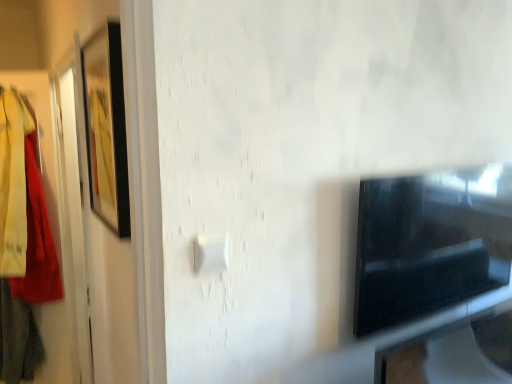
In order to face black glossy tv at right, should I rotate leftwards or rightwards?

Rotate your view right by about 24.188°.

Find the location of `white plastic light switch at center`. white plastic light switch at center is located at coordinates (211, 253).

This screenshot has height=384, width=512. Describe the element at coordinates (211, 253) in the screenshot. I see `white plastic light switch at center` at that location.

This screenshot has height=384, width=512. Find the location of `black glossy tv at right`. black glossy tv at right is located at coordinates (430, 243).

Does matte black picture frame at left turn towards black glossy tv at right?

No.

What are the coordinates of `picture frame above the black glossy tv at right (from a real-world perspective)` in the screenshot? It's located at (106, 128).

Is point (117, 90) closer to viewer compared to point (369, 246)?

Yes.

In terms of height, does matte black picture frame at left look taller or shorter compared to black glossy tv at right?

Clearly, matte black picture frame at left is taller compared to black glossy tv at right.

Considering the relative sizes of white plastic light switch at center and matte black picture frame at left in the image provided, is white plastic light switch at center shorter than matte black picture frame at left?

Indeed, white plastic light switch at center has a lesser height compared to matte black picture frame at left.

Is white plastic light switch at center oriented towards matte black picture frame at left?

No, white plastic light switch at center is not aimed at matte black picture frame at left.

What's the angular difference between white plastic light switch at center and matte black picture frame at left's facing directions?

The facing directions of white plastic light switch at center and matte black picture frame at left are 88.7 degrees apart.

From a real-world perspective, does white plastic light switch at center stand above matte black picture frame at left?

Actually, white plastic light switch at center is physically below matte black picture frame at left in the real world.

Which of these two, matte black picture frame at left or white plastic light switch at center, is smaller?

Smaller between the two is white plastic light switch at center.

From the image's perspective, which one is positioned higher, matte black picture frame at left or white plastic light switch at center?

From the image's view, matte black picture frame at left is above.

Is matte black picture frame at left far away from white plastic light switch at center?

No.

In the image, is black glossy tv at right positioned in front of or behind matte black picture frame at left?

In the image, black glossy tv at right appears behind matte black picture frame at left.

Can you confirm if black glossy tv at right is thinner than matte black picture frame at left?

No.

From the image's perspective, is black glossy tv at right beneath matte black picture frame at left?

Yes.

Is black glossy tv at right not within matte black picture frame at left?

Indeed, black glossy tv at right is completely outside matte black picture frame at left.

From the image's perspective, which is below, black glossy tv at right or white plastic light switch at center?

black glossy tv at right is shown below in the image.

From the picture: Can we say black glossy tv at right lies outside white plastic light switch at center?

Yes, black glossy tv at right is located beyond the bounds of white plastic light switch at center.

Which is more to the right, black glossy tv at right or white plastic light switch at center?

black glossy tv at right.

Can you confirm if black glossy tv at right is wider than white plastic light switch at center?

Correct, the width of black glossy tv at right exceeds that of white plastic light switch at center.

Is white plastic light switch at center aimed at black glossy tv at right?

No, white plastic light switch at center does not turn towards black glossy tv at right.

Does white plastic light switch at center have a greater width compared to black glossy tv at right?

Incorrect, the width of white plastic light switch at center does not surpass that of black glossy tv at right.

Does point (204, 270) come farther from viewer compared to point (448, 210)?

No, (204, 270) is closer to viewer.

From the image's perspective, would you say white plastic light switch at center is positioned over black glossy tv at right?

Correct, white plastic light switch at center appears higher than black glossy tv at right in the image.

This screenshot has width=512, height=384. Identify the location of picture frame above the black glossy tv at right (from a real-world perspective). (106, 128).

Find the location of `picture frame located behind the white plastic light switch at center`. picture frame located behind the white plastic light switch at center is located at coordinates (106, 128).

When comparing their distances from black glossy tv at right, does white plastic light switch at center or matte black picture frame at left seem closer?

The object closer to black glossy tv at right is white plastic light switch at center.

From the image, which object appears to be farther from black glossy tv at right, matte black picture frame at left or white plastic light switch at center?

Among the two, matte black picture frame at left is located further to black glossy tv at right.

Looking at the image, which one is located further to matte black picture frame at left, white plastic light switch at center or black glossy tv at right?

black glossy tv at right is positioned further to the anchor matte black picture frame at left.

Based on their spatial positions, is matte black picture frame at left or black glossy tv at right closer to white plastic light switch at center?

Based on the image, matte black picture frame at left appears to be nearer to white plastic light switch at center.

Looking at the image, which one is located further to white plastic light switch at center, black glossy tv at right or matte black picture frame at left?

Based on the image, black glossy tv at right appears to be further to white plastic light switch at center.

Looking at the image, which one is located closer to matte black picture frame at left, black glossy tv at right or white plastic light switch at center?

Among the two, white plastic light switch at center is located nearer to matte black picture frame at left.

Identify the location of light switch between matte black picture frame at left and black glossy tv at right from left to right. click(x=211, y=253).